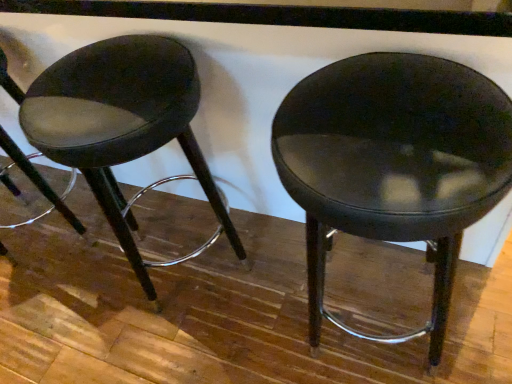
Locate an element on the screen. vacant region above matte black stool at left (from a real-world perspective) is located at coordinates (95, 77).